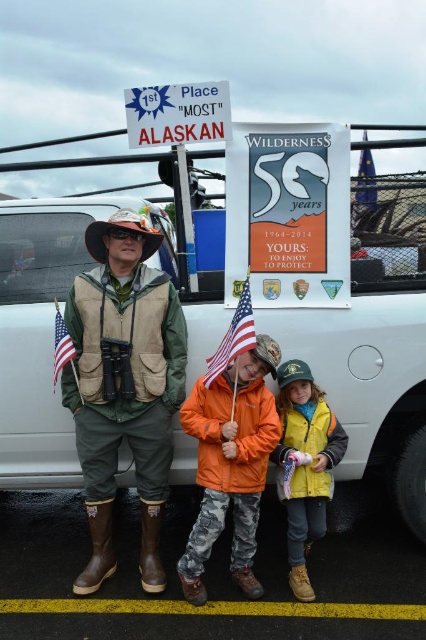
What is located at the point with coordinates (230, 464) in the image?

The orange fleece jacket at center is located at the point with coordinates (230, 464).

Based on the scene description, where is the orange fleece jacket at center located in the image?

The orange fleece jacket at center is located at point (230, 464) in the image.